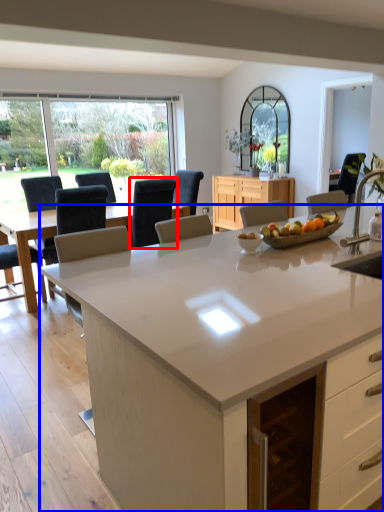
Question: Among these objects, which one is farthest to the camera, chair (highlighted by a red box) or countertop (highlighted by a blue box)?

Choices:
 (A) chair
 (B) countertop

Answer: (A)